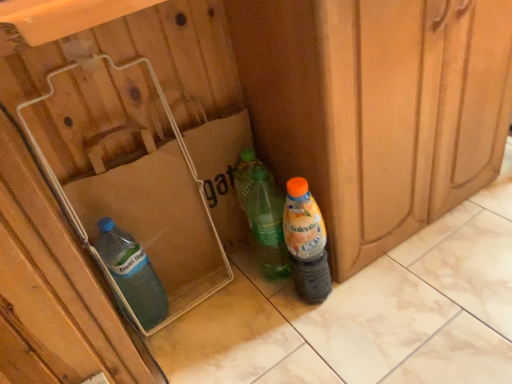
Question: Considering the positions of point (167, 309) and point (305, 200), is point (167, 309) closer or farther from the camera than point (305, 200)?

Choices:
 (A) closer
 (B) farther

Answer: (B)

Question: Based on their sizes in the image, would you say transparent plastic bottle at lower left, which appears as the second bottle when viewed from the right, is bigger or smaller than translucent plastic bottle at lower right, the second bottle positioned from the left?

Choices:
 (A) big
 (B) small

Answer: (B)

Question: Considering the real-world distances, which object is farthest from the transparent plastic bottle at lower left, the 1th bottle positioned from the left?

Choices:
 (A) translucent plastic box at lower left
 (B) translucent plastic bottle at lower right, the second bottle positioned from the left

Answer: (B)

Question: Which is nearer to the translucent plastic box at lower left?

Choices:
 (A) transparent plastic bottle at lower left, which appears as the second bottle when viewed from the right
 (B) translucent plastic bottle at lower right, the 1th bottle in the right-to-left sequence

Answer: (A)